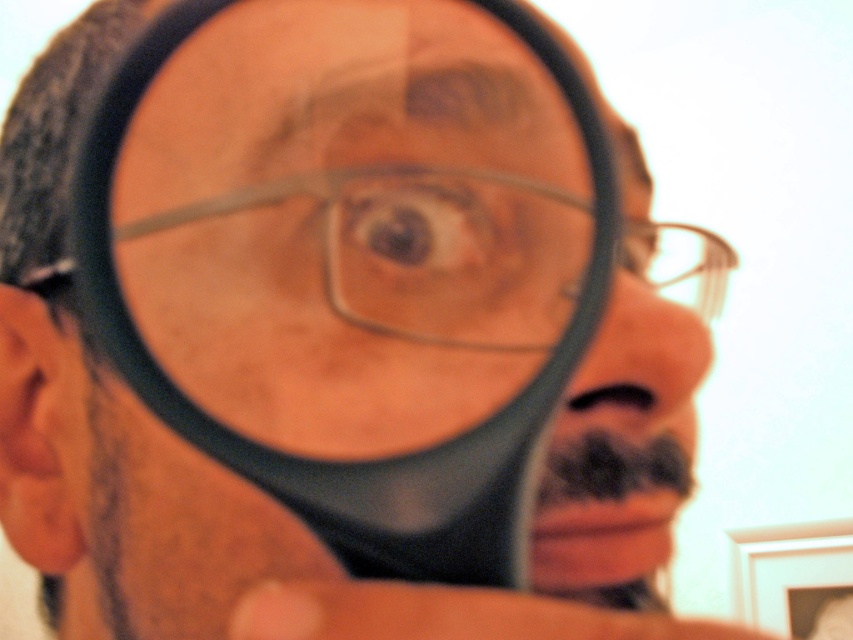
You are a character in a mystery novel who needs to examine a clue. You have a clear plastic magnifying glass at center and clear plastic glasses at center. Which object is closer to your eye?

The clear plastic magnifying glass at center is positioned over clear plastic glasses at center, so the magnifying glass is closer to your eye.

You are an engineer designing a virtual reality experience. You need to place two markers at the coordinates point (357, 545) and point (502, 241). Based on the image, which marker should be placed closer to the viewer?

Point (357, 545) is in front of point (502, 241), so the marker at point (357, 545) should be placed closer to the viewer.